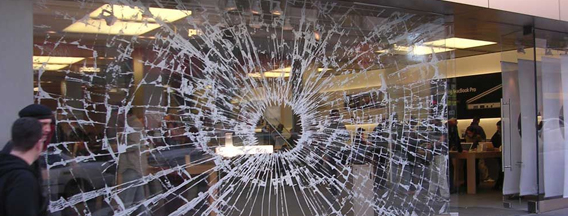
The height and width of the screenshot is (216, 568). What are the coordinates of `ceiling light` in the screenshot? It's located at tap(459, 46).